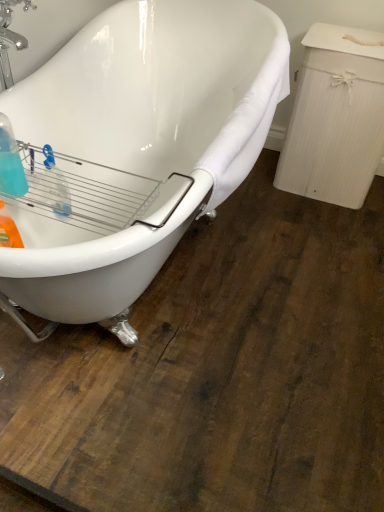
Question: From the image's perspective, is white glossy bathtub at upper left located beneath translucent plastic bottle at left?

Choices:
 (A) no
 (B) yes

Answer: (A)

Question: Considering the relative sizes of white glossy bathtub at upper left and translucent plastic bottle at left in the image provided, is white glossy bathtub at upper left bigger than translucent plastic bottle at left?

Choices:
 (A) yes
 (B) no

Answer: (A)

Question: Is white glossy bathtub at upper left oriented away from translucent plastic bottle at left?

Choices:
 (A) yes
 (B) no

Answer: (A)

Question: Considering the relative sizes of white glossy bathtub at upper left and translucent plastic bottle at left in the image provided, is white glossy bathtub at upper left taller than translucent plastic bottle at left?

Choices:
 (A) yes
 (B) no

Answer: (A)

Question: Can you confirm if white glossy bathtub at upper left is shorter than translucent plastic bottle at left?

Choices:
 (A) yes
 (B) no

Answer: (B)

Question: Is white glossy bathtub at upper left wider than translucent plastic bottle at left?

Choices:
 (A) yes
 (B) no

Answer: (A)

Question: Does translucent plastic bottle at left appear on the left side of white glossy bathtub at upper left?

Choices:
 (A) yes
 (B) no

Answer: (A)

Question: Is translucent plastic bottle at left turned away from white glossy bathtub at upper left?

Choices:
 (A) yes
 (B) no

Answer: (A)

Question: From a real-world perspective, is translucent plastic bottle at left on top of white glossy bathtub at upper left?

Choices:
 (A) no
 (B) yes

Answer: (B)

Question: From the image's perspective, is translucent plastic bottle at left above white glossy bathtub at upper left?

Choices:
 (A) no
 (B) yes

Answer: (A)

Question: Is the position of translucent plastic bottle at left less distant than that of white glossy bathtub at upper left?

Choices:
 (A) yes
 (B) no

Answer: (B)

Question: Would you say translucent plastic bottle at left is outside white glossy bathtub at upper left?

Choices:
 (A) yes
 (B) no

Answer: (B)

Question: From the image's perspective, is white glossy bathtub at upper left above or below translucent plastic bottle at left?

Choices:
 (A) above
 (B) below

Answer: (A)